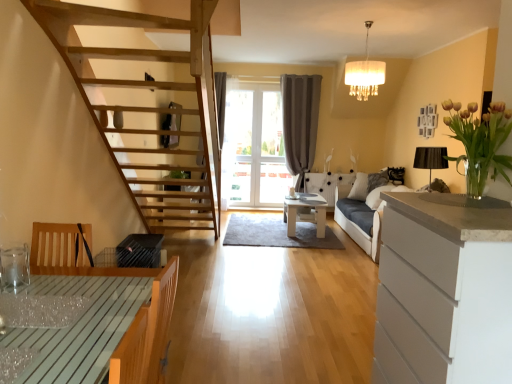
Question: Is white glossy table at center, which is the 2th table from front to back, at the right side of dark gray fabric couch at right?

Choices:
 (A) yes
 (B) no

Answer: (B)

Question: From the image's perspective, is white glossy table at center, the second table when ordered from left to right, on dark gray fabric couch at right?

Choices:
 (A) yes
 (B) no

Answer: (B)

Question: Considering the relative positions of white glossy table at center, the 1th table viewed from the back, and dark gray fabric couch at right in the image provided, is white glossy table at center, the 1th table viewed from the back, to the left of dark gray fabric couch at right from the viewer's perspective?

Choices:
 (A) yes
 (B) no

Answer: (A)

Question: Is white glossy table at center, placed as the 1th table when sorted from right to left, shorter than dark gray fabric couch at right?

Choices:
 (A) no
 (B) yes

Answer: (B)

Question: From a real-world perspective, is white glossy table at center, which is the 2th table from front to back, physically above dark gray fabric couch at right?

Choices:
 (A) yes
 (B) no

Answer: (B)

Question: Is wooden table at lower left, arranged as the 2th table when viewed from the back, spatially inside gray fabric curtain at center, or outside of it?

Choices:
 (A) outside
 (B) inside

Answer: (A)

Question: Considering the positions of wooden table at lower left, arranged as the 2th table when viewed from the back, and gray fabric curtain at center in the image, is wooden table at lower left, arranged as the 2th table when viewed from the back, wider or thinner than gray fabric curtain at center?

Choices:
 (A) thin
 (B) wide

Answer: (B)

Question: Looking at the image, does wooden table at lower left, the first table viewed from the front, seem bigger or smaller compared to gray fabric curtain at center?

Choices:
 (A) small
 (B) big

Answer: (B)

Question: Does point (74, 370) appear closer or farther from the camera than point (295, 117)?

Choices:
 (A) farther
 (B) closer

Answer: (B)

Question: Would you say wooden table at lower left, the first table positioned from the left, is inside or outside transparent glass table at lower left?

Choices:
 (A) outside
 (B) inside

Answer: (A)

Question: Considering their positions, is wooden table at lower left, arranged as the 2th table when viewed from the back, located in front of or behind transparent glass table at lower left?

Choices:
 (A) behind
 (B) front

Answer: (B)

Question: From the image's perspective, is wooden table at lower left, which is the 2th table in right-to-left order, positioned above or below transparent glass table at lower left?

Choices:
 (A) below
 (B) above

Answer: (A)

Question: Is wooden table at lower left, the first table positioned from the left, bigger or smaller than transparent glass table at lower left?

Choices:
 (A) small
 (B) big

Answer: (B)

Question: Is transparent glass table at lower left wider or thinner than dark gray fabric couch at right?

Choices:
 (A) thin
 (B) wide

Answer: (A)

Question: Considering the positions of point (78, 314) and point (335, 221), is point (78, 314) closer or farther from the camera than point (335, 221)?

Choices:
 (A) farther
 (B) closer

Answer: (B)